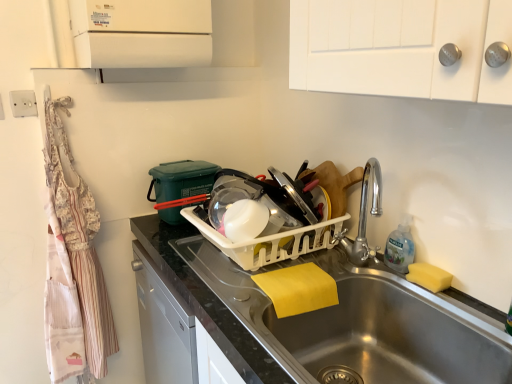
Question: Can you confirm if yellow sponge at sink right is thinner than white floral apron at left?

Choices:
 (A) no
 (B) yes

Answer: (B)

Question: Can you confirm if yellow sponge at sink right is taller than white floral apron at left?

Choices:
 (A) yes
 (B) no

Answer: (B)

Question: Is white floral apron at left completely or partially inside yellow sponge at sink right?

Choices:
 (A) no
 (B) yes

Answer: (A)

Question: Is yellow sponge at sink right to the right of white floral apron at left from the viewer's perspective?

Choices:
 (A) no
 (B) yes

Answer: (B)

Question: Is yellow sponge at sink right to the left of white floral apron at left from the viewer's perspective?

Choices:
 (A) no
 (B) yes

Answer: (A)

Question: Considering the relative sizes of yellow sponge at sink right and white floral apron at left in the image provided, is yellow sponge at sink right shorter than white floral apron at left?

Choices:
 (A) no
 (B) yes

Answer: (B)

Question: Is white floral apron at left directly adjacent to stainless steel sink at lower center?

Choices:
 (A) no
 (B) yes

Answer: (A)

Question: Considering the relative positions of white floral apron at left and stainless steel sink at lower center in the image provided, is white floral apron at left to the left of stainless steel sink at lower center from the viewer's perspective?

Choices:
 (A) no
 (B) yes

Answer: (B)

Question: Is white floral apron at left oriented away from stainless steel sink at lower center?

Choices:
 (A) yes
 (B) no

Answer: (B)

Question: Are white floral apron at left and stainless steel sink at lower center far apart?

Choices:
 (A) yes
 (B) no

Answer: (B)

Question: Is white floral apron at left at the right side of stainless steel sink at lower center?

Choices:
 (A) yes
 (B) no

Answer: (B)

Question: Does white floral apron at left have a smaller size compared to stainless steel sink at lower center?

Choices:
 (A) no
 (B) yes

Answer: (B)

Question: Can you confirm if clear plastic bottle at sink right is positioned to the right of yellow sponge at sink right?

Choices:
 (A) no
 (B) yes

Answer: (A)